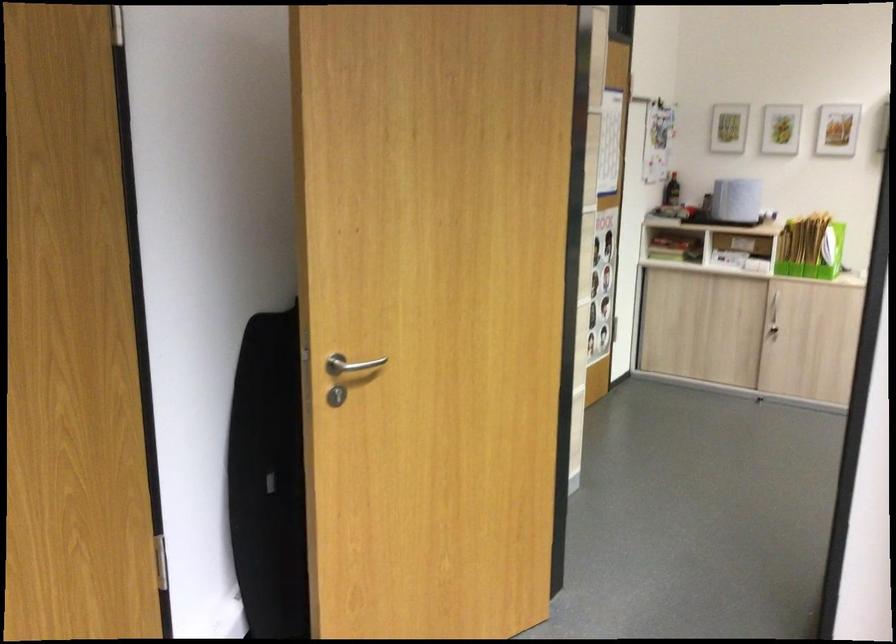
Identify the location of cabinet door handle. (771, 317).